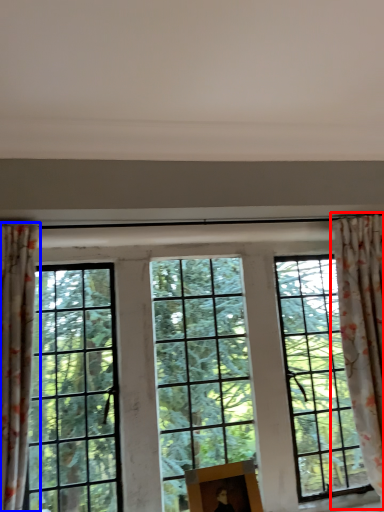
Question: Which point is closer to the camera, curtain (highlighted by a red box) or curtain (highlighted by a blue box)?

Choices:
 (A) curtain
 (B) curtain

Answer: (B)